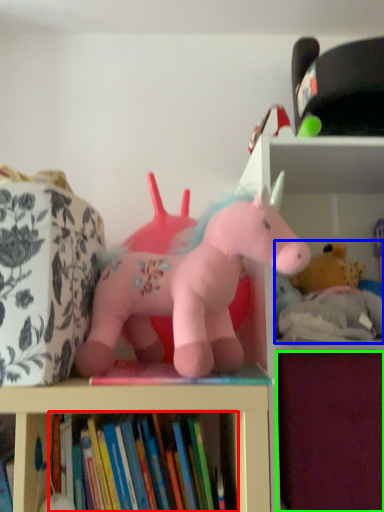
Question: Estimate the real-world distances between objects in this image. Which object is farther from book (highlighted by a red box), toy (highlighted by a blue box) or drawer (highlighted by a green box)?

Choices:
 (A) toy
 (B) drawer

Answer: (A)